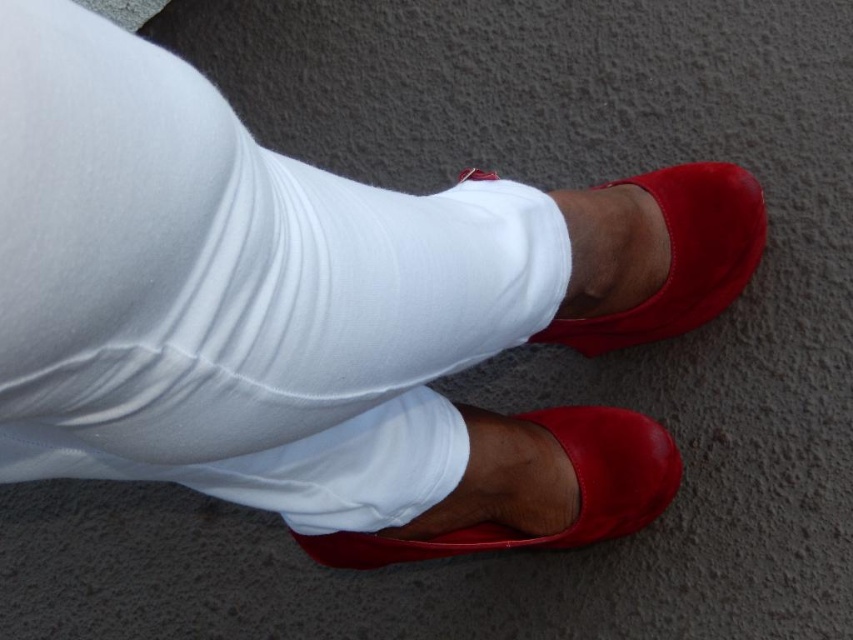
You are a fashion designer observing the image. You need to determine which shoe is more suitable for a client who prefers larger footwear. Which one between the shiny leather shoe at lower center and the satin red shoe at center would you recommend?

The shiny leather shoe at lower center has a larger size compared to the satin red shoe at center, so it is more suitable for a client who prefers larger footwear.

You are a fashion designer observing the person wearing shiny leather shoe at lower center and satin red shoe at center. Which shoe is wider?

The shiny leather shoe at lower center is wider than the satin red shoe at center.